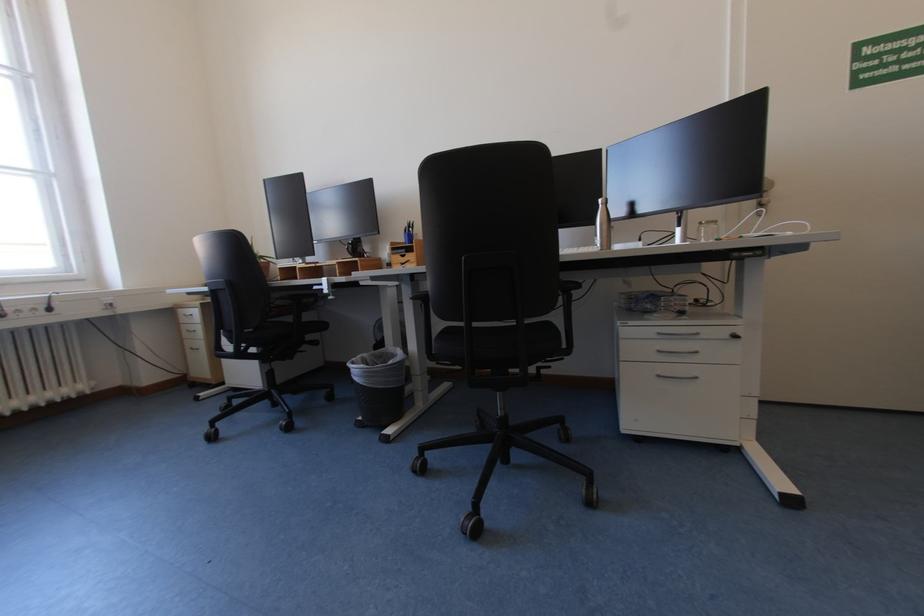
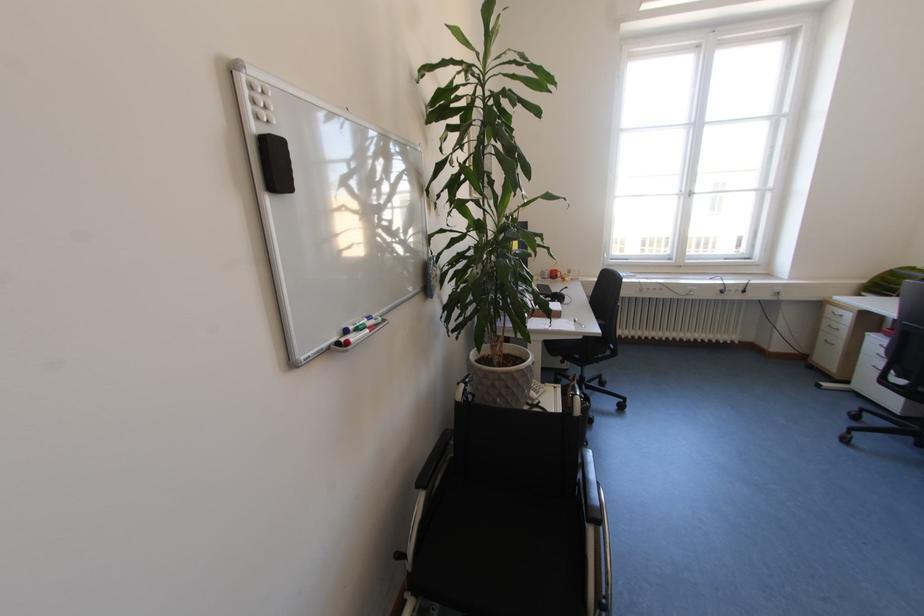
Where in the second image is the point corresponding to point (200, 350) from the first image?

(833, 342)